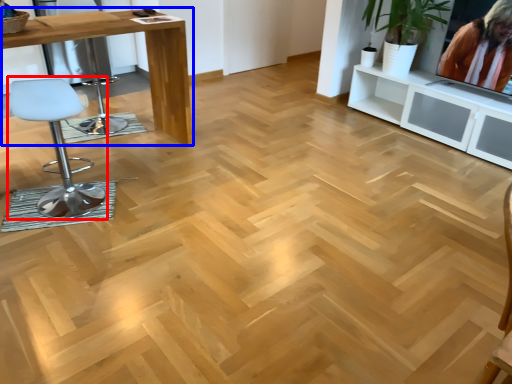
Question: Among these objects, which one is farthest to the camera, chair (highlighted by a red box) or table (highlighted by a blue box)?

Choices:
 (A) chair
 (B) table

Answer: (B)